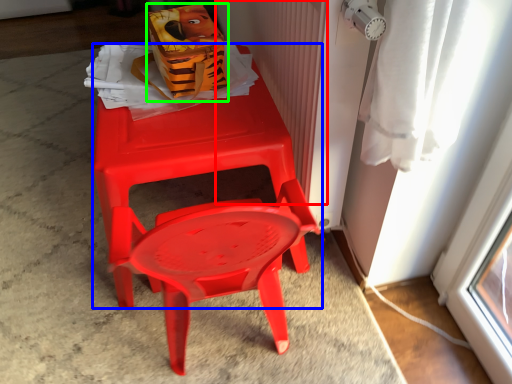
Question: Which object is the farthest from radiator (highlighted by a red box)? Choose among these: chair (highlighted by a blue box) or lunch box (highlighted by a green box).

Choices:
 (A) chair
 (B) lunch box

Answer: (B)